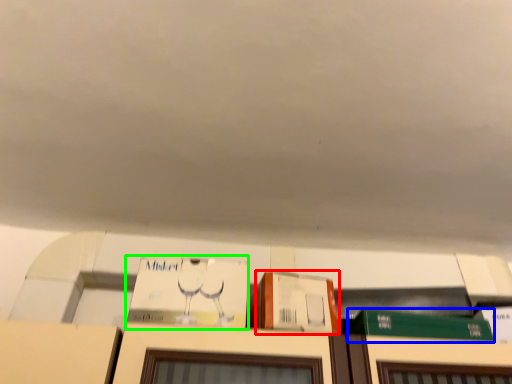
Question: Which is nearer to the cardboard box (highlighted by a red box)? book (highlighted by a blue box) or book (highlighted by a green box).

Choices:
 (A) book
 (B) book

Answer: (B)